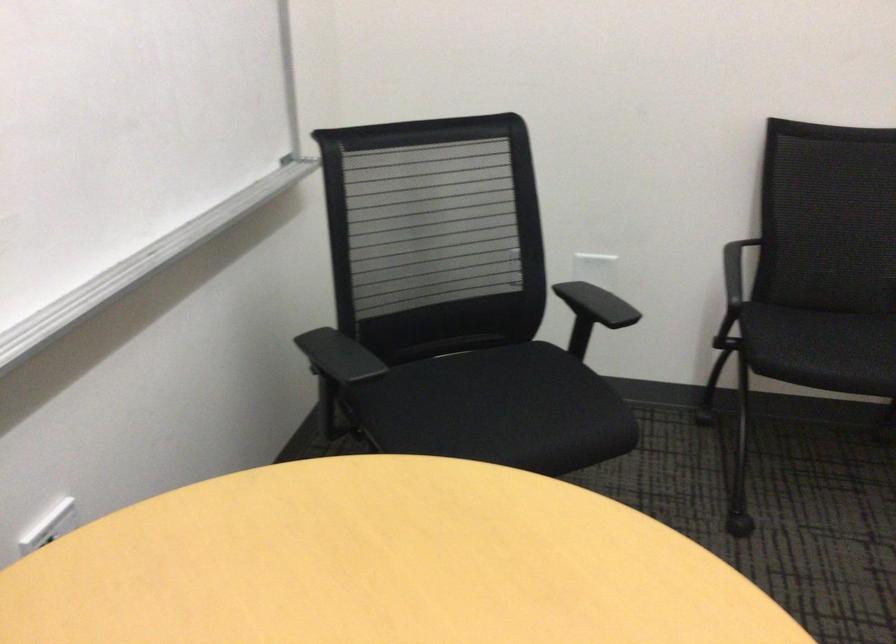
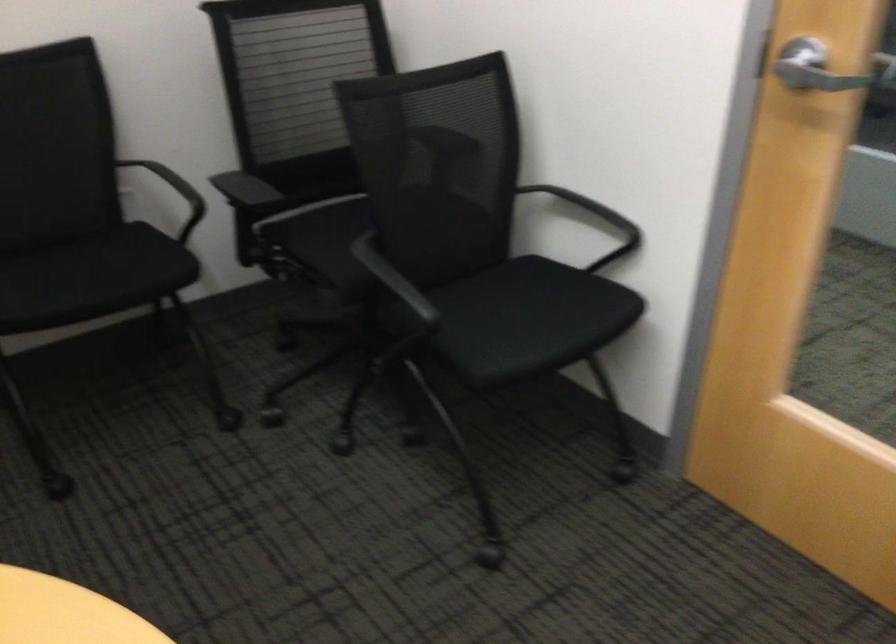
Question: How did the camera likely rotate?

Choices:
 (A) Left
 (B) Right
 (C) Up
 (D) Down

Answer: (B)